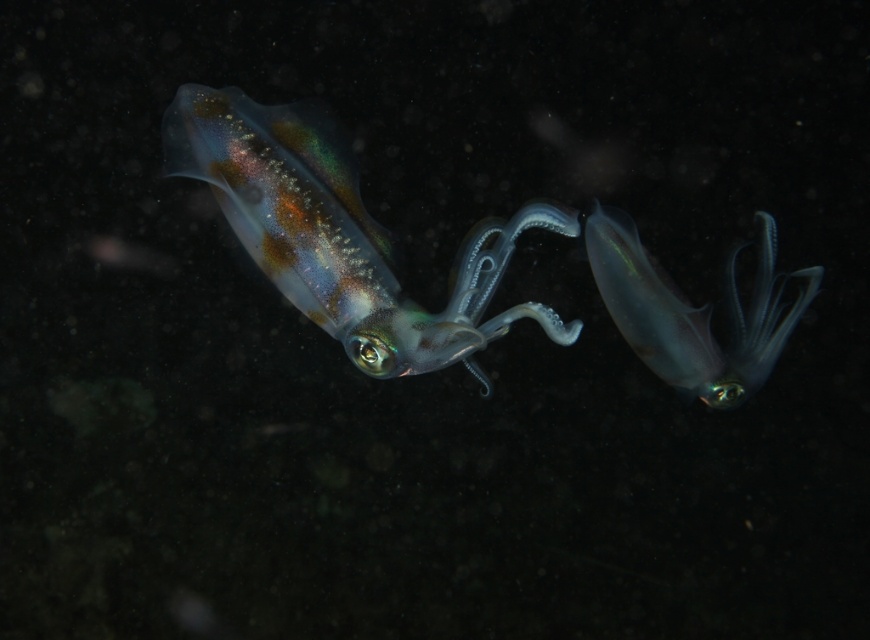
You are an underwater photographer aiming to capture both the translucent iridescent squid at center and the translucent blue squid at center in a single frame. Based on their widths, which squid will appear wider in your photo?

The translucent iridescent squid at center will appear wider in the photo because its width surpasses that of the translucent blue squid at center.

You are an underwater photographer aiming to capture a clear shot of both the translucent iridescent squid at center and the translucent blue squid at center. Based on their positions, which squid should you focus on first to ensure it appears sharp in your photo?

You should focus on the translucent iridescent squid at center first because it is closer to the viewer than the translucent blue squid at center. By focusing on the closer squid, you can ensure it appears sharp, and the background squid may still be in acceptable focus depending on your camera settings.

Based on the photo, you are an underwater photographer aiming to capture both the translucent iridescent squid at center and the translucent blue squid at center in a single shot. Given their sizes, which squid will appear larger in your camera frame?

The translucent iridescent squid at center will appear larger in the camera frame because it is bigger than the translucent blue squid at center.